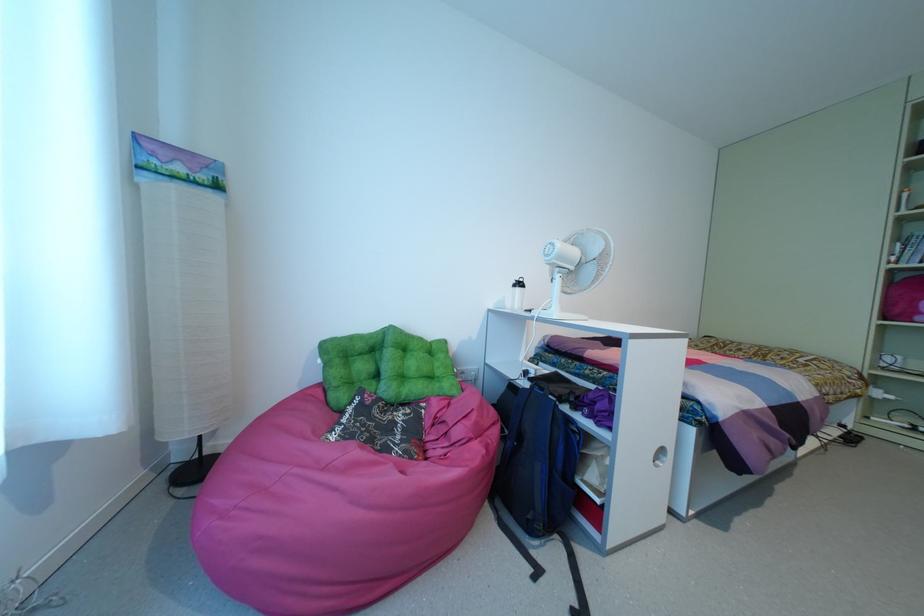
Locate an element on the screen. This screenshot has height=616, width=924. round cabinet handle is located at coordinates (660, 456).